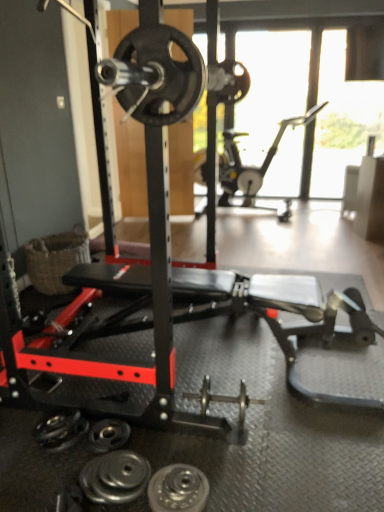
Where is `free space to the right of polished silver dumbbell at center, acting as the second dumbbell starting from the front`? The image size is (384, 512). free space to the right of polished silver dumbbell at center, acting as the second dumbbell starting from the front is located at coordinates (287, 423).